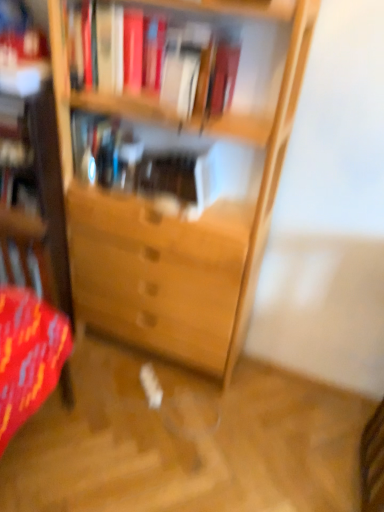
Question: Is translucent glass vase at center, which is counted as the second book, starting from the front, next to hardcover books at upper center, the second book viewed from the back?

Choices:
 (A) no
 (B) yes

Answer: (A)

Question: Considering the relative sizes of translucent glass vase at center, placed as the first book when sorted from back to front, and hardcover books at upper center, the second book viewed from the back, in the image provided, is translucent glass vase at center, placed as the first book when sorted from back to front, smaller than hardcover books at upper center, the second book viewed from the back,?

Choices:
 (A) no
 (B) yes

Answer: (B)

Question: Is translucent glass vase at center, which is counted as the second book, starting from the front, to the left of hardcover books at upper center, which is the first book in front-to-back order, from the viewer's perspective?

Choices:
 (A) no
 (B) yes

Answer: (B)

Question: Is translucent glass vase at center, which is counted as the second book, starting from the front, at the right side of hardcover books at upper center, which is the first book in front-to-back order?

Choices:
 (A) yes
 (B) no

Answer: (B)

Question: Does translucent glass vase at center, placed as the first book when sorted from back to front, have a lesser height compared to hardcover books at upper center, which is the first book in front-to-back order?

Choices:
 (A) no
 (B) yes

Answer: (B)

Question: Is translucent glass vase at center, placed as the first book when sorted from back to front, positioned behind hardcover books at upper center, the second book viewed from the back?

Choices:
 (A) yes
 (B) no

Answer: (A)

Question: Can you confirm if hardcover books at upper center, the second book viewed from the back, is taller than translucent glass vase at center, which is counted as the second book, starting from the front?

Choices:
 (A) yes
 (B) no

Answer: (A)

Question: Considering the relative sizes of hardcover books at upper center, which is the first book in front-to-back order, and translucent glass vase at center, placed as the first book when sorted from back to front, in the image provided, is hardcover books at upper center, which is the first book in front-to-back order, shorter than translucent glass vase at center, placed as the first book when sorted from back to front,?

Choices:
 (A) yes
 (B) no

Answer: (B)

Question: Is hardcover books at upper center, which is the first book in front-to-back order, next to translucent glass vase at center, placed as the first book when sorted from back to front, and touching it?

Choices:
 (A) yes
 (B) no

Answer: (B)

Question: Is hardcover books at upper center, the second book viewed from the back, not within translucent glass vase at center, placed as the first book when sorted from back to front?

Choices:
 (A) no
 (B) yes

Answer: (B)

Question: Considering the relative positions of hardcover books at upper center, the second book viewed from the back, and translucent glass vase at center, which is counted as the second book, starting from the front, in the image provided, is hardcover books at upper center, the second book viewed from the back, behind translucent glass vase at center, which is counted as the second book, starting from the front,?

Choices:
 (A) yes
 (B) no

Answer: (B)

Question: Is translucent glass vase at center, which is counted as the second book, starting from the front, surrounded by hardcover books at upper center, the second book viewed from the back?

Choices:
 (A) yes
 (B) no

Answer: (B)

Question: Is translucent glass vase at center, which is counted as the second book, starting from the front, in front of or behind hardcover books at upper center, which is the first book in front-to-back order, in the image?

Choices:
 (A) behind
 (B) front

Answer: (A)